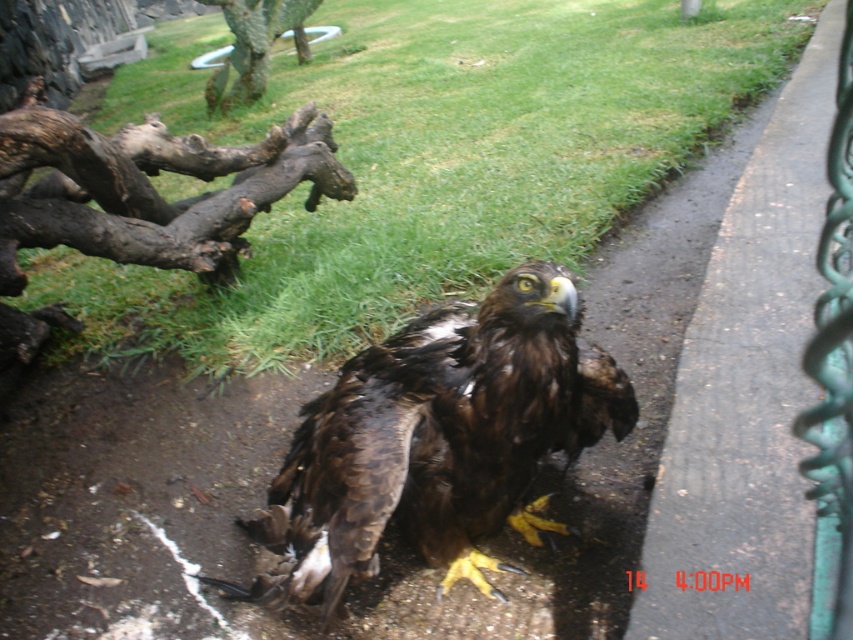
Is point (264, 328) positioned after point (427, 490)?

Yes, point (264, 328) is farther from viewer.

Does green grass at upper center have a lesser width compared to brown feathered eagle at center?

No, green grass at upper center is not thinner than brown feathered eagle at center.

Is point (227, 342) positioned behind point (480, 429)?

Yes, it is behind point (480, 429).

Find the location of `green grass at upper center`. green grass at upper center is located at coordinates (424, 161).

Can you confirm if green grass at upper center is positioned to the right of green textured fence at right?

Incorrect, green grass at upper center is not on the right side of green textured fence at right.

Which is in front, point (456, 97) or point (831, 541)?

Point (831, 541) is more forward.

Locate an element on the screen. green grass at upper center is located at coordinates (424, 161).

Looking at this image, is brown feathered eagle at center bigger than brown rough log at upper left?

No, brown feathered eagle at center is not bigger than brown rough log at upper left.

Between brown feathered eagle at center and brown rough log at upper left, which one appears on the left side from the viewer's perspective?

brown rough log at upper left

Identify the location of brown feathered eagle at center. (438, 440).